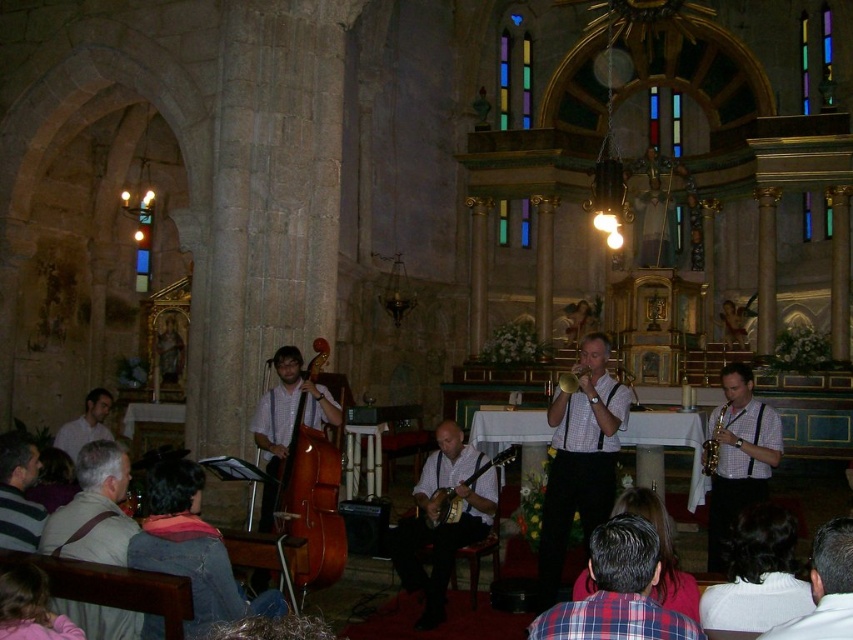
Question: Which point is closer to the camera?

Choices:
 (A) (4, 477)
 (B) (715, 428)
 (C) (573, 385)
 (D) (491, 467)

Answer: (A)

Question: Is plaid shirt at lower center smaller than white shirt at left?

Choices:
 (A) no
 (B) yes

Answer: (B)

Question: Is white checkered shirt at center smaller than white shirt at left?

Choices:
 (A) no
 (B) yes

Answer: (A)

Question: Which of the following is the farthest from the observer?

Choices:
 (A) white shirt at left
 (B) gold brass trumpet at center
 (C) gray fabric shirt at lower left

Answer: (A)

Question: Which point is closer to the camera?

Choices:
 (A) (33, 529)
 (B) (633, 596)
 (C) (701, 468)
 (D) (407, 588)

Answer: (B)

Question: Is gray fabric shirt at lower left wider than dark brown leather jacket at lower right?

Choices:
 (A) no
 (B) yes

Answer: (B)